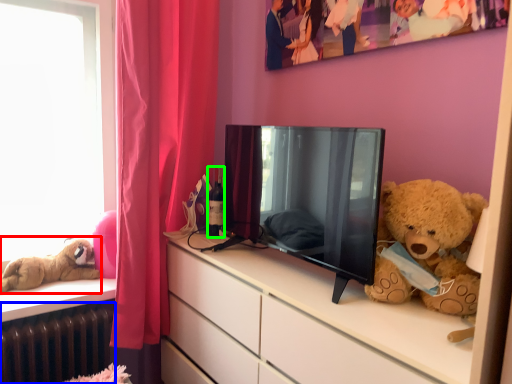
Question: Based on their relative distances, which object is nearer to teddy bear (highlighted by a red box)? Choose from radiator (highlighted by a blue box) and bottle (highlighted by a green box).

Choices:
 (A) radiator
 (B) bottle

Answer: (A)